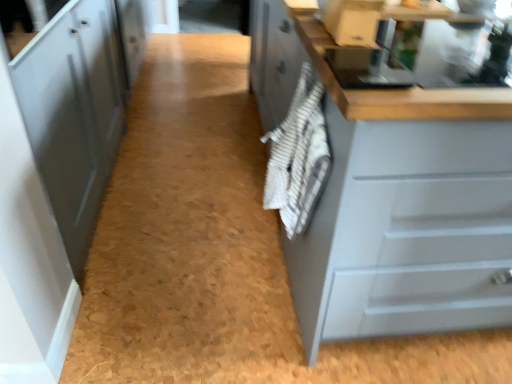
Question: Choose the correct answer: Is white striped towel at center inside matte gray cabinet at right, positioned as the first cabinetry in right-to-left order, or outside it?

Choices:
 (A) inside
 (B) outside

Answer: (B)

Question: Is white striped towel at center to the left or to the right of matte gray cabinet at right, positioned as the first cabinetry in right-to-left order, in the image?

Choices:
 (A) right
 (B) left

Answer: (B)

Question: Considering the real-world distances, which object is farthest from the white striped towel at center?

Choices:
 (A) matte gray cabinet at left, marked as the 1th cabinetry in a left-to-right arrangement
 (B) matte gray cabinet at right, which ranks as the second cabinetry in left-to-right order

Answer: (A)

Question: Considering the real-world distances, which object is closest to the white striped towel at center?

Choices:
 (A) matte gray cabinet at right, positioned as the first cabinetry in right-to-left order
 (B) matte gray cabinet at left, marked as the 1th cabinetry in a left-to-right arrangement

Answer: (A)